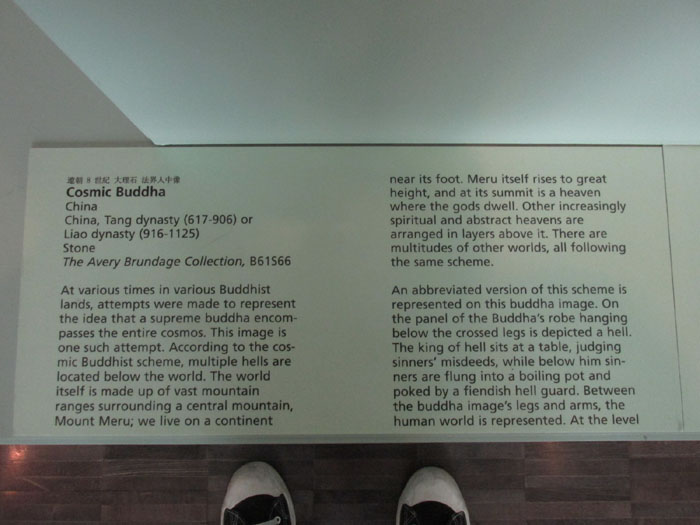
The height and width of the screenshot is (525, 700). What are the coordinates of `dark wooden slat floor` in the screenshot? It's located at (532, 458), (355, 484), (106, 481), (62, 496), (176, 503), (645, 507), (360, 508), (596, 468).